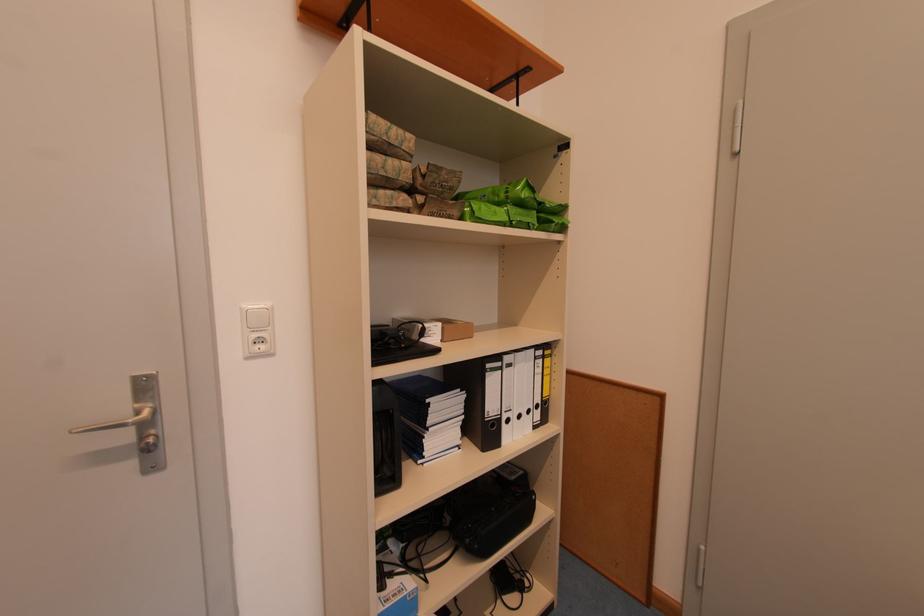
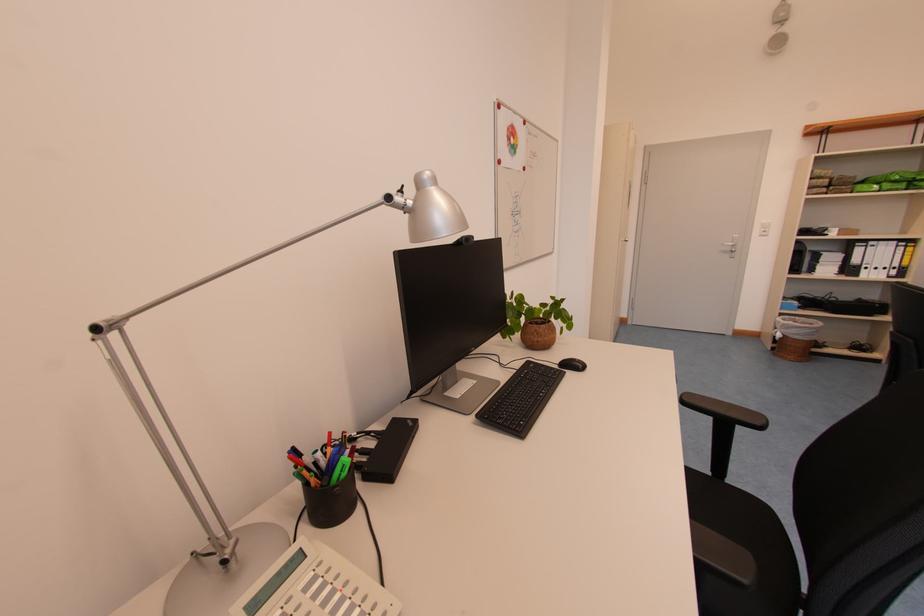
Find the pixel in the second image that matches the point at 540,353 in the first image.

(903, 245)